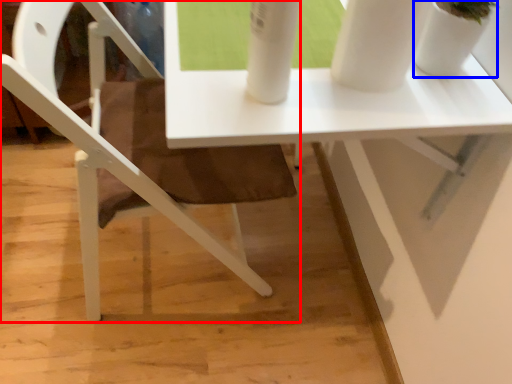
Question: Among these objects, which one is farthest to the camera, chair (highlighted by a red box) or glass vase (highlighted by a blue box)?

Choices:
 (A) chair
 (B) glass vase

Answer: (A)